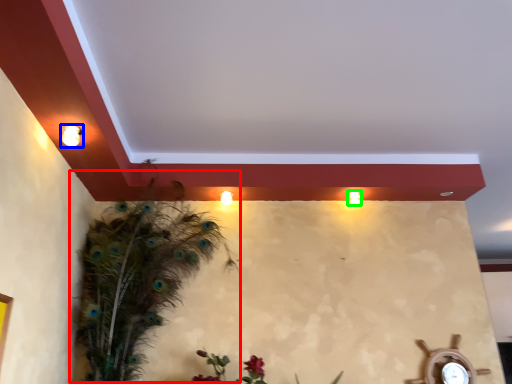
Question: Considering the real-world distances, which object is farthest from bird (highlighted by a red box)? light fixture (highlighted by a blue box) or light (highlighted by a green box)?

Choices:
 (A) light fixture
 (B) light

Answer: (B)